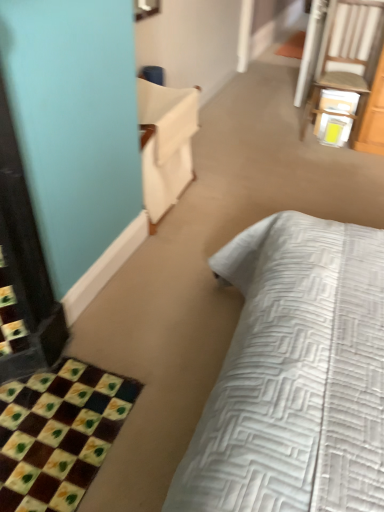
The width and height of the screenshot is (384, 512). I want to click on blank space above checkerboard fabric bath mat at lower left (from a real-world perspective), so [48, 426].